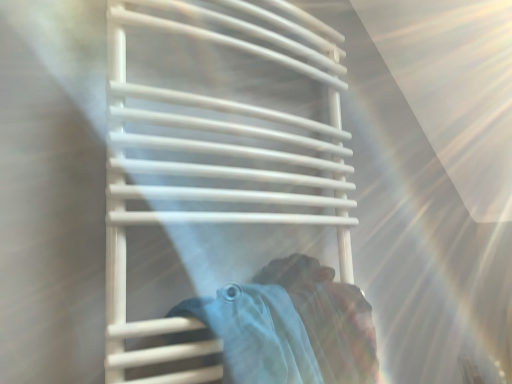
What is the approximate width of light blue fabric at center?

7.10 inches.

The width and height of the screenshot is (512, 384). I want to click on light blue fabric at center, so click(291, 326).

Measure the distance between point [322,330] and camera.

Point [322,330] is 31.14 inches from camera.

This screenshot has height=384, width=512. Describe the element at coordinates (291, 326) in the screenshot. I see `light blue fabric at center` at that location.

The height and width of the screenshot is (384, 512). Describe the element at coordinates (219, 149) in the screenshot. I see `white plastic towel rack at center` at that location.

This screenshot has width=512, height=384. What are the coordinates of `white plastic towel rack at center` in the screenshot? It's located at (219, 149).

Measure the distance between white plastic towel rack at center and camera.

24.22 inches.

Where is `light blue fabric at center`? Image resolution: width=512 pixels, height=384 pixels. light blue fabric at center is located at coordinates (291, 326).

Is white plastic towel rack at center to the right of light blue fabric at center from the viewer's perspective?

Yes.

Which object is closer to the camera taking this photo, white plastic towel rack at center or light blue fabric at center?

Positioned in front is white plastic towel rack at center.

Does point (179, 158) come closer to viewer compared to point (286, 286)?

Yes, point (179, 158) is closer to viewer.

From the image's perspective, relative to light blue fabric at center, is white plastic towel rack at center above or below?

From the image's perspective, white plastic towel rack at center appears above light blue fabric at center.

From a real-world perspective, is white plastic towel rack at center positioned above or below light blue fabric at center?

In terms of real-world spatial position, white plastic towel rack at center is above light blue fabric at center.

Which of these two, white plastic towel rack at center or light blue fabric at center, is thinner?

light blue fabric at center is thinner.

Is white plastic towel rack at center taller than light blue fabric at center?

Indeed, white plastic towel rack at center has a greater height compared to light blue fabric at center.

Who is smaller, white plastic towel rack at center or light blue fabric at center?

light blue fabric at center is smaller.

Is white plastic towel rack at center surrounding light blue fabric at center?

Yes, light blue fabric at center is surrounded by white plastic towel rack at center.

Is there a large distance between white plastic towel rack at center and light blue fabric at center?

Actually, white plastic towel rack at center and light blue fabric at center are a little close together.

Is white plastic towel rack at center turned away from light blue fabric at center?

Yes.

I want to click on woman behind the white plastic towel rack at center, so click(x=291, y=326).

Is light blue fabric at center at the left side of white plastic towel rack at center?

Yes.

Is light blue fabric at center behind white plastic towel rack at center?

Yes, light blue fabric at center is further from the viewer.

Is point (331, 343) positioned behind point (173, 356)?

Yes, it is.

From the image's perspective, would you say light blue fabric at center is shown under white plastic towel rack at center?

Indeed, from the image's perspective, light blue fabric at center is shown beneath white plastic towel rack at center.

From a real-world perspective, is light blue fabric at center physically above white plastic towel rack at center?

No, from a real-world perspective, light blue fabric at center is not on top of white plastic towel rack at center.

Which of these two, light blue fabric at center or white plastic towel rack at center, is wider?

With larger width is white plastic towel rack at center.

Considering the relative sizes of light blue fabric at center and white plastic towel rack at center in the image provided, is light blue fabric at center taller than white plastic towel rack at center?

Incorrect, the height of light blue fabric at center is not larger of that of white plastic towel rack at center.

Looking at this image, considering the sizes of objects light blue fabric at center and white plastic towel rack at center in the image provided, who is bigger, light blue fabric at center or white plastic towel rack at center?

white plastic towel rack at center is bigger.

Is white plastic towel rack at center inside light blue fabric at center?

No.

Are light blue fabric at center and white plastic towel rack at center located far from each other?

No, light blue fabric at center is in close proximity to white plastic towel rack at center.

Is light blue fabric at center facing towards white plastic towel rack at center?

Yes, light blue fabric at center is facing white plastic towel rack at center.

Can you tell me how much light blue fabric at center and white plastic towel rack at center differ in facing direction?

6.12e-05 degrees separate the facing orientations of light blue fabric at center and white plastic towel rack at center.

Locate an element on the screen. woman that appears on the left of white plastic towel rack at center is located at coordinates (291, 326).

Where is `woman that appears below the white plastic towel rack at center (from the image's perspective)`? woman that appears below the white plastic towel rack at center (from the image's perspective) is located at coordinates (291, 326).

The height and width of the screenshot is (384, 512). In order to click on woman to the left of white plastic towel rack at center in this screenshot , I will do `click(291, 326)`.